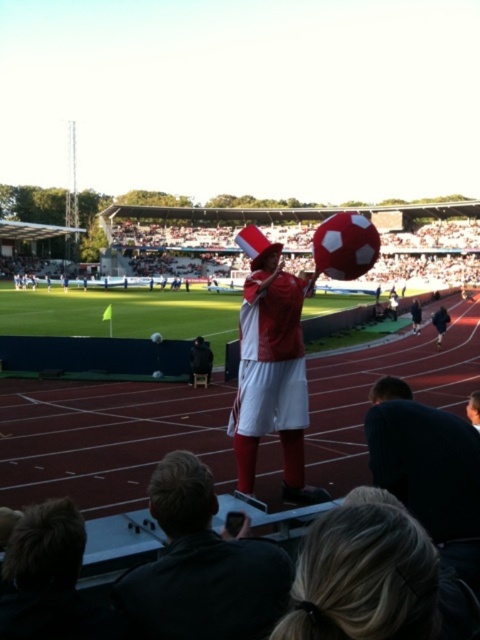
Does matte black jacket at center come in front of matte red hat at center?

Yes, matte black jacket at center is in front of matte red hat at center.

Does matte black jacket at center have a smaller size compared to matte red hat at center?

Indeed, matte black jacket at center has a smaller size compared to matte red hat at center.

Describe the element at coordinates (202, 566) in the screenshot. I see `matte black jacket at center` at that location.

Locate an element on the screen. The width and height of the screenshot is (480, 640). matte black jacket at center is located at coordinates click(x=202, y=566).

Is point (203, 529) farther from camera compared to point (444, 321)?

No, it is not.

Which of these two, matte black jacket at center or dark blue fabric jacket at center, stands shorter?

Standing shorter between the two is matte black jacket at center.

Which is behind, point (165, 561) or point (441, 310)?

Point (441, 310)

Identify the location of matte black jacket at center. This screenshot has height=640, width=480. (202, 566).

Does matte red hat at center appear on the right side of dark blue fabric jacket at center?

No, matte red hat at center is not to the right of dark blue fabric jacket at center.

Is matte red hat at center to the left of dark blue fabric jacket at center from the viewer's perspective?

Yes, matte red hat at center is to the left of dark blue fabric jacket at center.

Which is behind, point (264, 284) or point (441, 320)?

The point (441, 320) is more distant.

You are a GUI agent. You are given a task and a screenshot of the screen. Output one action in this format:
    pyautogui.click(x=<x>, y=<y>)
    Task: Click on the matte red hat at center
    This screenshot has width=480, height=640.
    Given the screenshot: What is the action you would take?
    pyautogui.click(x=272, y=368)